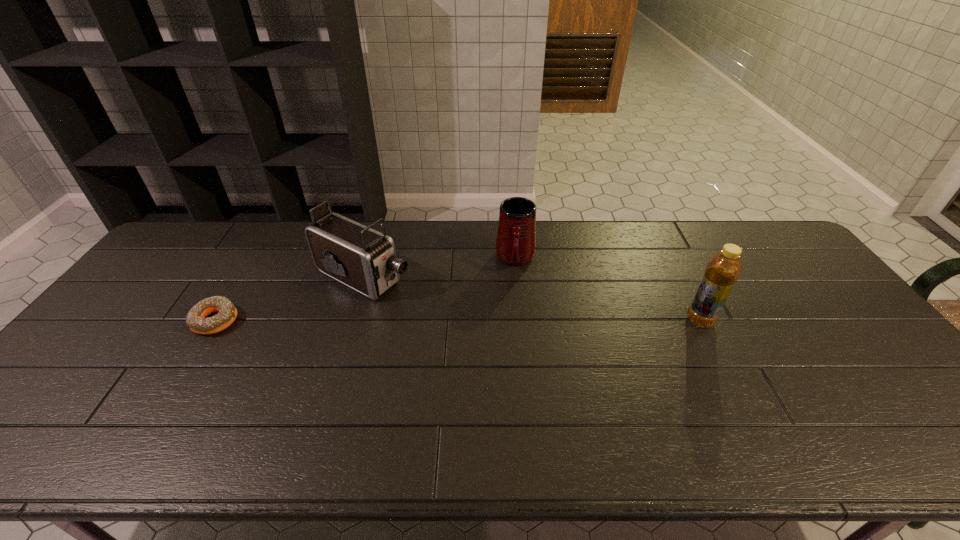
You are a GUI agent. You are given a task and a screenshot of the screen. Output one action in this format:
    pyautogui.click(x=<x>, y=<y>)
    Task: Click on the shortest object
    
    Given the screenshot: What is the action you would take?
    pyautogui.click(x=195, y=320)

Where is `the leftmost object`? the leftmost object is located at coordinates (195, 320).

Identify the location of the rightmost object. The height and width of the screenshot is (540, 960). (723, 269).

Identify the location of the third tallest object. (516, 237).

The image size is (960, 540). I want to click on the third object from left to right, so click(x=516, y=237).

Locate an element on the screen. The height and width of the screenshot is (540, 960). camcorder is located at coordinates (357, 256).

This screenshot has height=540, width=960. Identify the location of free point located on the left of the leftmost object. (143, 321).

Identify the location of vacant space located 0.380m on the right of the bottle. (850, 320).

You are a GUI agent. You are given a task and a screenshot of the screen. Output one action in this format:
    pyautogui.click(x=<x>, y=<y>)
    Task: Click on the vacant space located 0.370m on the side of the third tallest object with the handle
    The height and width of the screenshot is (540, 960).
    Given the screenshot: What is the action you would take?
    [510, 374]

Locate an element on the screen. vacant space located on the side of the third tallest object with the handle is located at coordinates (513, 319).